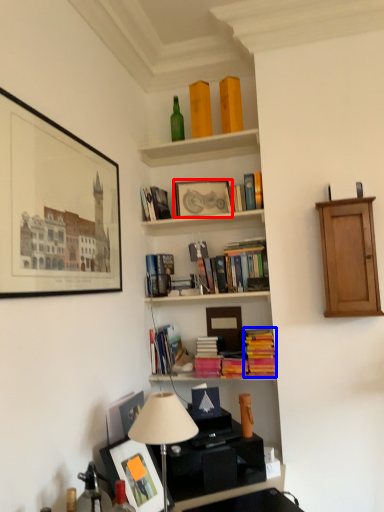
Question: Which object is closer to the camera taking this photo, picture frame (highlighted by a red box) or book (highlighted by a blue box)?

Choices:
 (A) picture frame
 (B) book

Answer: (B)